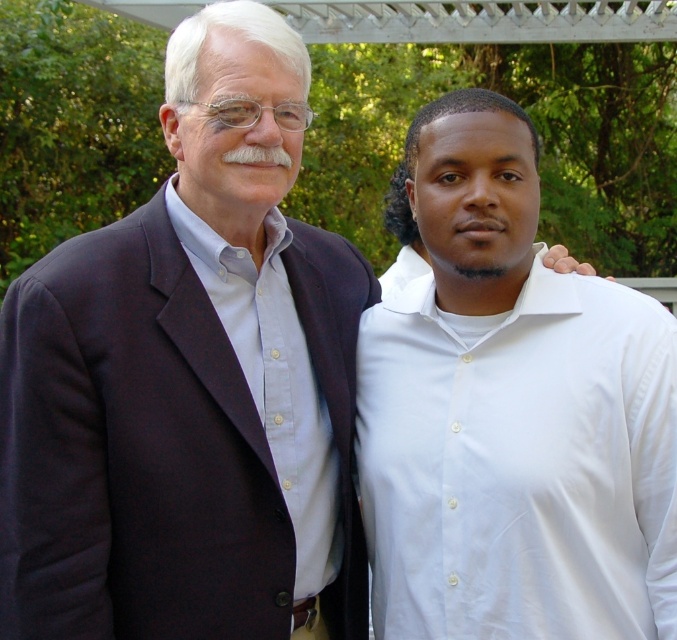
From the picture: You are organizing a photoshoot and need to arrange the dark blue fabric business suit at left and the light blue cotton shirt at left in a row for a catalog. Based on their positions in the original image, which one should be placed on the left side of the row?

The dark blue fabric business suit at left should be placed on the left side of the row because it is positioned to the left of the light blue cotton shirt at left in the original image.

You are at a park and see two people wearing shirts. The person on the left has a light blue cotton shirt at left, and the person on the right has a white smooth shirt at right. Which shirt is positioned more to the east if the sun is setting to the west?

The white smooth shirt at right is positioned more to the east because it is to the right of the light blue cotton shirt at left, and since the sun is setting to the west, the right side of the image would face east.

You are a photographer at a formal event. You need to adjust the lighting so that the dark blue fabric business suit at left and the white smooth shirt at right are both well lit. Which object should you focus on first to ensure proper exposure?

The dark blue fabric business suit at left is above the white smooth shirt at right, so focusing on the dark blue fabric business suit at left first will help balance the exposure since it is positioned higher and may receive different lighting due to its elevated placement.